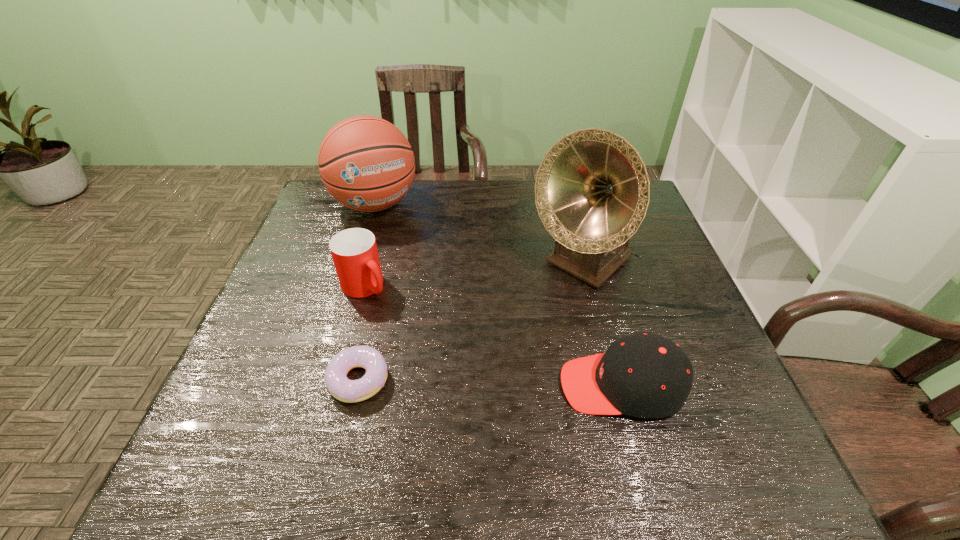
This screenshot has width=960, height=540. I want to click on vacant space located on the horn of the phonograph record, so click(522, 317).

This screenshot has height=540, width=960. In order to click on vacant region located 0.390m on the horn of the phonograph record in this screenshot , I will do `click(440, 390)`.

What are the coordinates of `vacant area situated 0.340m on the horn of the phonograph record` in the screenshot? It's located at (457, 375).

Locate an element on the screen. The image size is (960, 540). vacant area situated on the side of the cup with the handle is located at coordinates (452, 364).

Locate an element on the screen. The height and width of the screenshot is (540, 960). free space located 0.210m on the side of the cup with the handle is located at coordinates (434, 348).

This screenshot has height=540, width=960. Identify the location of vacant space located on the side of the cup with the handle. (412, 328).

Find the location of `vacant space located 0.110m on the logo side of the farthest object`. vacant space located 0.110m on the logo side of the farthest object is located at coordinates (396, 250).

What are the coordinates of `vacant point located on the logo side of the farthest object` in the screenshot? It's located at (394, 246).

What are the coordinates of `vacant space situated on the logo side of the farthest object` in the screenshot? It's located at (422, 312).

Locate an element on the screen. object present at the far edge is located at coordinates [366, 163].